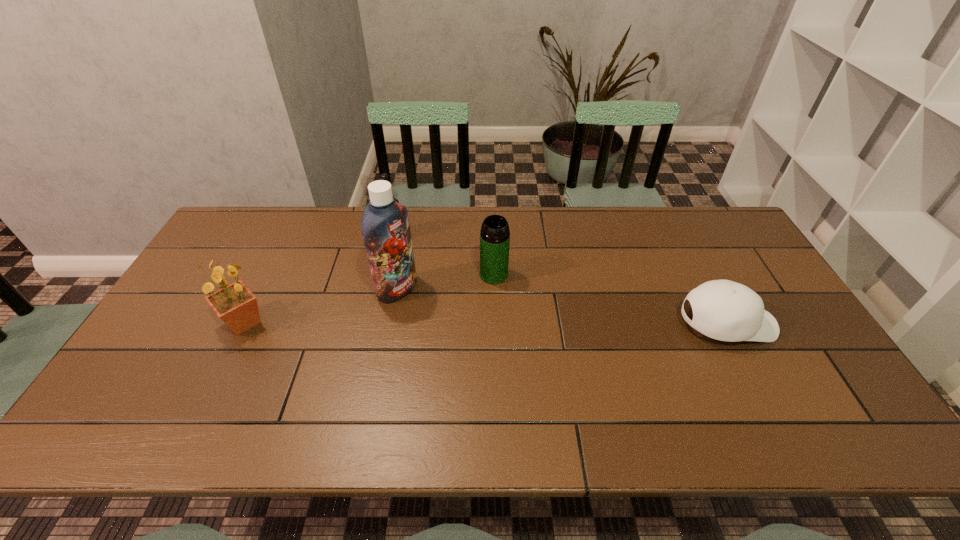
The width and height of the screenshot is (960, 540). I want to click on free space on the desktop that is between the leftmost object and the shortest object and is positioned on the label of the farthest object, so click(496, 323).

Identify the location of free space on the desktop that is between the leftmost object and the shortest object and is positioned on the front label of the shampoo. (453, 323).

The width and height of the screenshot is (960, 540). Identify the location of vacant space on the desktop that is between the sunflower and the shortest object and is positioned from the spout of the thermos bottle. (530, 323).